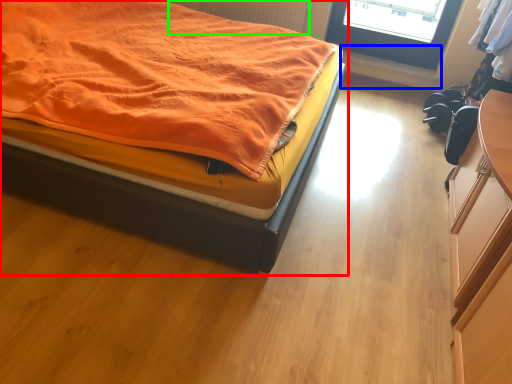
Question: Estimate the real-world distances between objects in this image. Which object is closer to bed (highlighted by a red box), window sill (highlighted by a blue box) or radiator (highlighted by a green box)?

Choices:
 (A) window sill
 (B) radiator

Answer: (B)